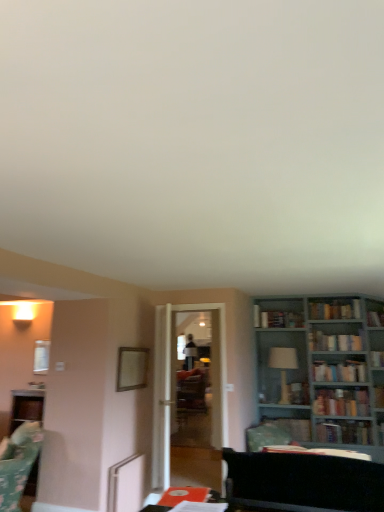
At what (x,y) coordinates should I click in order to perform the action: click on blank area beneath wooden picture frame at upper center (from a real-world perspective). Please return your answer as a coordinate pair (x, y). This screenshot has height=512, width=384. Looking at the image, I should click on (130, 456).